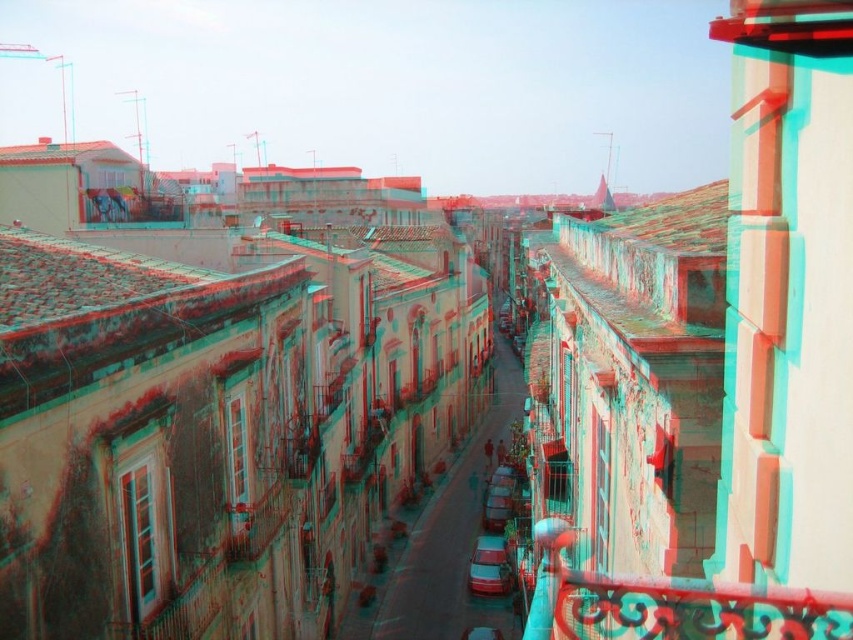
Who is positioned more to the left, polished metal railing at center right or shiny red car at center?

polished metal railing at center right

Can you confirm if polished metal railing at center right is shorter than shiny red car at center?

No.

Which is in front, point (730, 611) or point (503, 516)?

Point (730, 611) is more forward.

Find the location of a particular element. The image size is (853, 640). polished metal railing at center right is located at coordinates (692, 609).

Between point (502, 540) and point (498, 525), which one is positioned behind?

The point (498, 525) is more distant.

Locate an element on the screen. The width and height of the screenshot is (853, 640). metallic silver car at center is located at coordinates [489, 566].

Between point (469, 577) and point (498, 490), which one is positioned behind?

The point (498, 490) is behind.

Find the location of a particular element. The image size is (853, 640). metallic silver car at center is located at coordinates (489, 566).

Is point (641, 628) positioned after point (492, 564)?

No.

This screenshot has width=853, height=640. What do you see at coordinates (692, 609) in the screenshot? I see `polished metal railing at center right` at bounding box center [692, 609].

Describe the element at coordinates (692, 609) in the screenshot. Image resolution: width=853 pixels, height=640 pixels. I see `polished metal railing at center right` at that location.

Locate an element on the screen. The height and width of the screenshot is (640, 853). polished metal railing at center right is located at coordinates (692, 609).